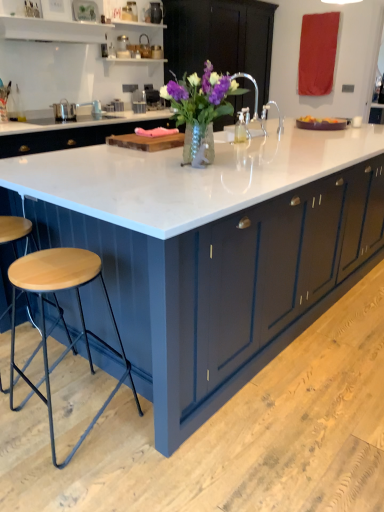
Where is `vacant area that lies to the right of translucent glass vase with purple flowers at center`? vacant area that lies to the right of translucent glass vase with purple flowers at center is located at coordinates (272, 166).